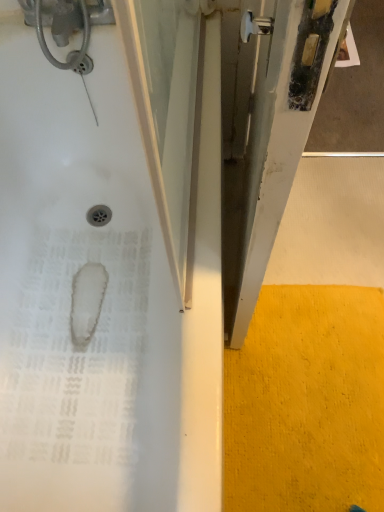
Question: Is the surface of white glossy bathtub at left in direct contact with yellow textured carpet at lower right?

Choices:
 (A) yes
 (B) no

Answer: (B)

Question: Can you confirm if white glossy bathtub at left is positioned to the left of yellow textured carpet at lower right?

Choices:
 (A) no
 (B) yes

Answer: (B)

Question: Is white glossy bathtub at left shorter than yellow textured carpet at lower right?

Choices:
 (A) no
 (B) yes

Answer: (A)

Question: Does white glossy bathtub at left come in front of yellow textured carpet at lower right?

Choices:
 (A) yes
 (B) no

Answer: (A)

Question: Does white glossy bathtub at left appear on the right side of yellow textured carpet at lower right?

Choices:
 (A) no
 (B) yes

Answer: (A)

Question: Is white glossy bathtub at left behind yellow textured carpet at lower right?

Choices:
 (A) no
 (B) yes

Answer: (A)

Question: Considering the relative sizes of yellow textured carpet at lower right and white glossy bathtub at left in the image provided, is yellow textured carpet at lower right thinner than white glossy bathtub at left?

Choices:
 (A) yes
 (B) no

Answer: (A)

Question: From a real-world perspective, is yellow textured carpet at lower right beneath white glossy bathtub at left?

Choices:
 (A) no
 (B) yes

Answer: (B)

Question: Is yellow textured carpet at lower right behind white glossy bathtub at left?

Choices:
 (A) no
 (B) yes

Answer: (B)

Question: Does yellow textured carpet at lower right have a lesser height compared to white glossy bathtub at left?

Choices:
 (A) yes
 (B) no

Answer: (A)

Question: Is yellow textured carpet at lower right at the right side of white glossy bathtub at left?

Choices:
 (A) yes
 (B) no

Answer: (A)

Question: Is yellow textured carpet at lower right completely or partially outside of white glossy bathtub at left?

Choices:
 (A) no
 (B) yes

Answer: (B)

Question: Based on their sizes in the image, would you say white glossy bathtub at left is bigger or smaller than yellow textured carpet at lower right?

Choices:
 (A) big
 (B) small

Answer: (A)